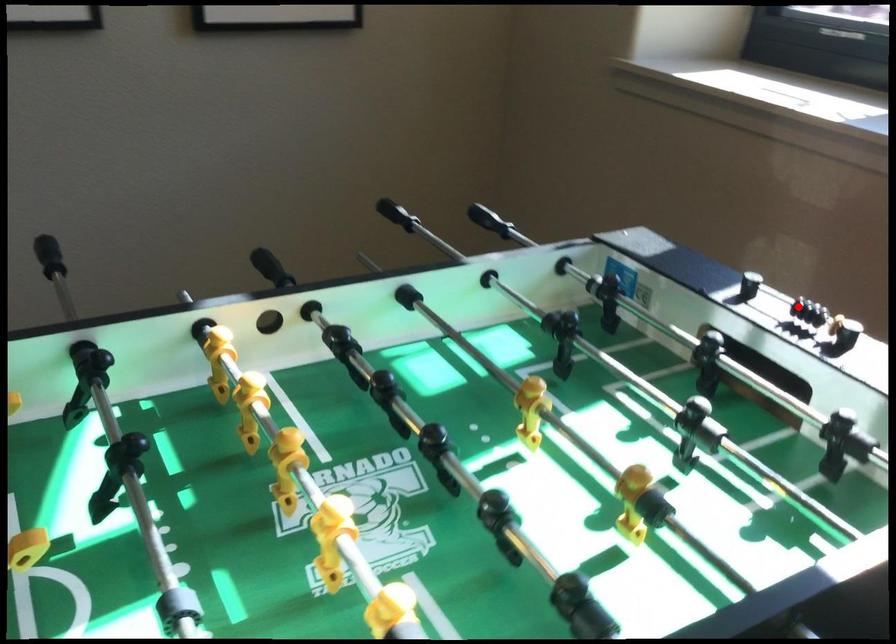
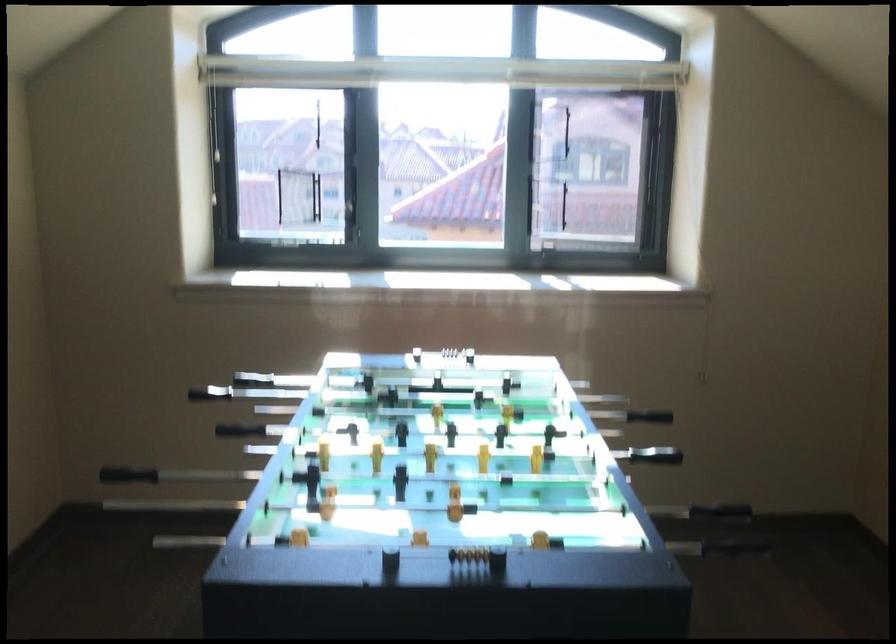
Question: I am providing you with two images of the same scene from different viewpoints. Image1 has a red point marked. In image2, the corresponding 3D location appears at what relative position? Reply with the corresponding letter.

Choices:
 (A) Closer
 (B) Farther

Answer: (B)